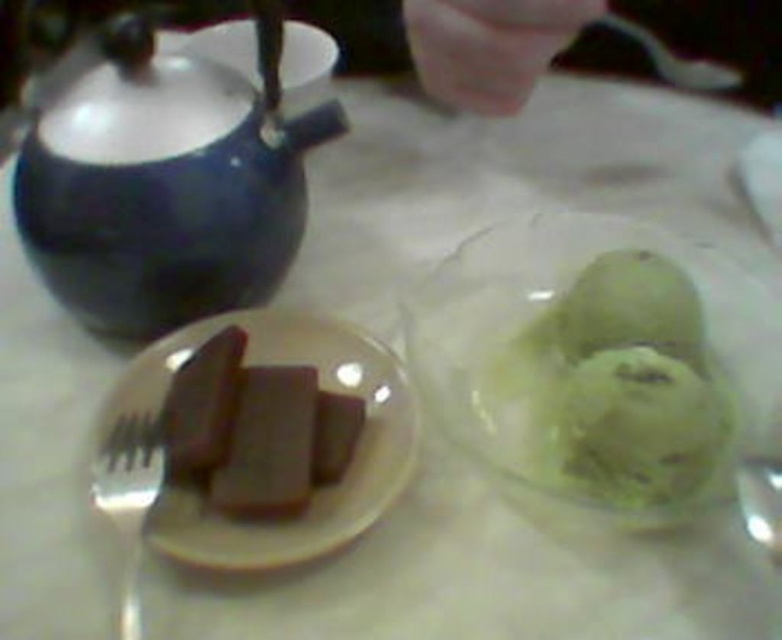
Can you confirm if dark brown chocolate at center is thinner than silver metallic fork at lower left?

No.

Can you confirm if dark brown chocolate at center is smaller than silver metallic fork at lower left?

Actually, dark brown chocolate at center might be larger than silver metallic fork at lower left.

Identify the location of dark brown chocolate at center. (253, 429).

Which is behind, point (547, 388) or point (135, 538)?

The point (547, 388) is behind.

Is point (605, 252) less distant than point (144, 468)?

No, (605, 252) is further to viewer.

Find the location of a particular element. Image resolution: width=782 pixels, height=640 pixels. green matte ice cream at right is located at coordinates (612, 388).

Based on the photo, does matte black teapot at upper left have a lesser height compared to matte brown chocolate at left?

No, matte black teapot at upper left is not shorter than matte brown chocolate at left.

Does matte black teapot at upper left have a larger size compared to matte brown chocolate at left?

Indeed, matte black teapot at upper left has a larger size compared to matte brown chocolate at left.

Identify the location of matte black teapot at upper left. Image resolution: width=782 pixels, height=640 pixels. (174, 173).